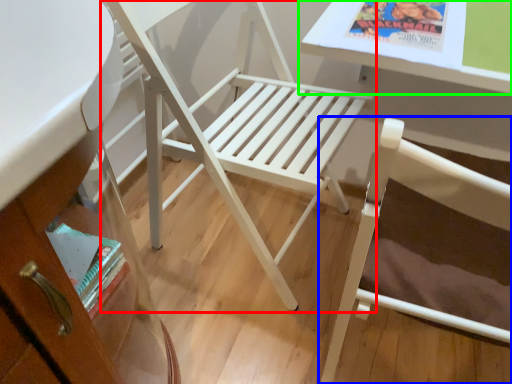
Question: Which is nearer to the chair (highlighted by a red box)? chair (highlighted by a blue box) or table (highlighted by a green box).

Choices:
 (A) chair
 (B) table

Answer: (B)